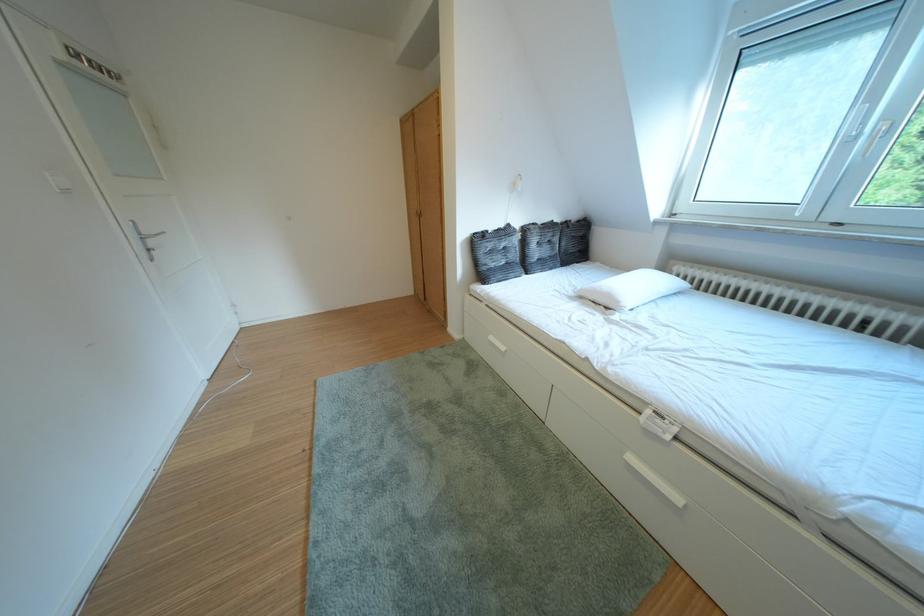
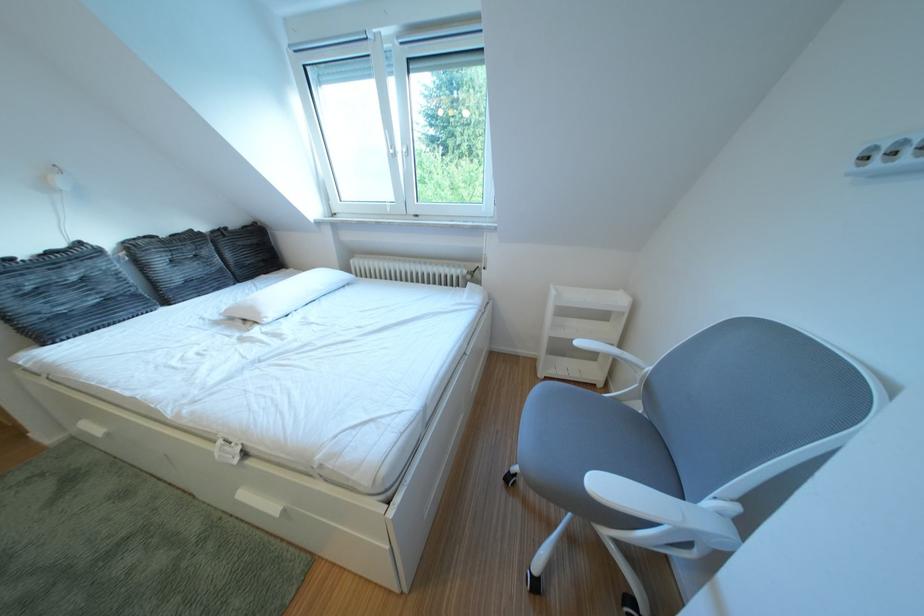
Find the pixel in the second image that matches [553,228] in the first image.

(176, 240)